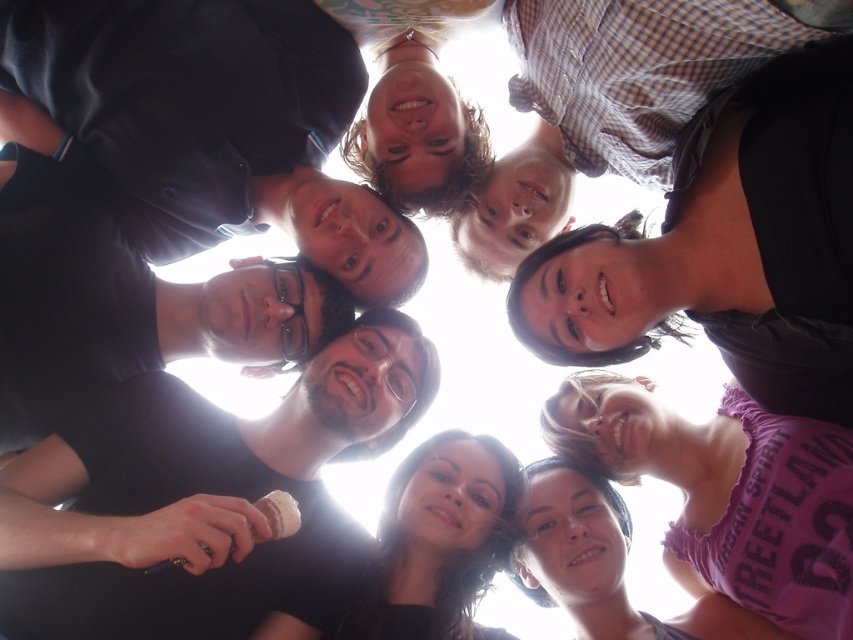
Question: Which is nearer to the black matte shirt at upper left?

Choices:
 (A) black matte ice cream cone at center
 (B) checkered shirt at upper center

Answer: (A)

Question: Is black matte ice cream cone at center wider than checkered shirt at upper center?

Choices:
 (A) yes
 (B) no

Answer: (A)

Question: Can you confirm if black matte ice cream cone at center is smaller than black matte shirt at upper left?

Choices:
 (A) no
 (B) yes

Answer: (A)

Question: Which of the following is the farthest from the observer?

Choices:
 (A) (180, 92)
 (B) (738, 19)
 (C) (86, 536)

Answer: (A)

Question: Does black matte shirt at upper left appear on the left side of checkered shirt at upper center?

Choices:
 (A) no
 (B) yes

Answer: (B)

Question: Which of the following is the farthest from the observer?

Choices:
 (A) checkered shirt at upper center
 (B) black matte shirt at upper left

Answer: (B)